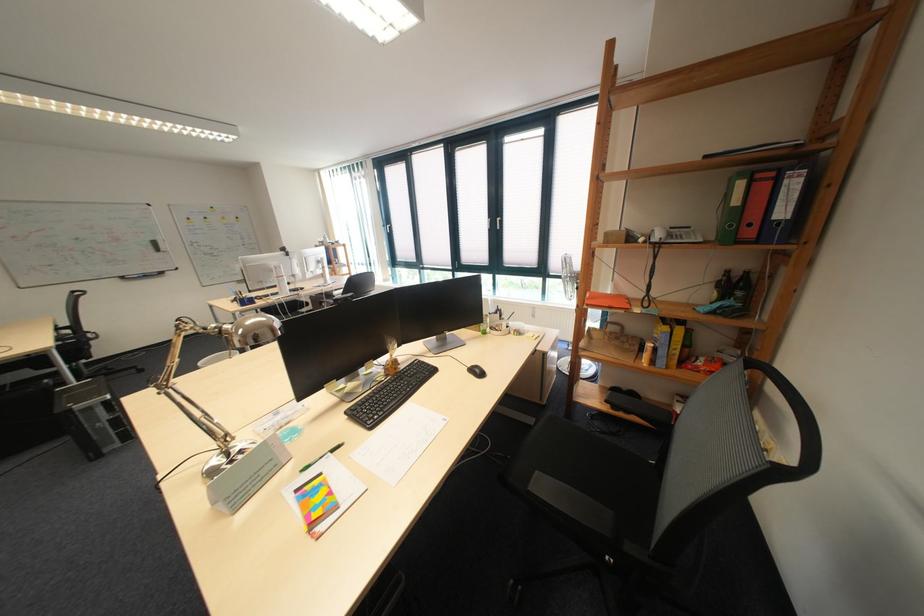
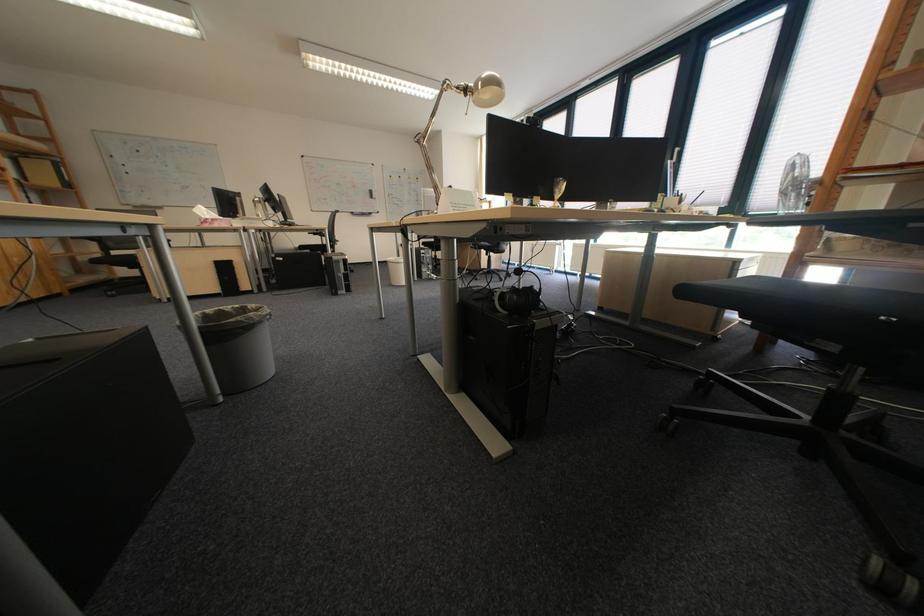
Where in the second image is the point corresponding to (x=254, y=333) from the first image?

(495, 84)